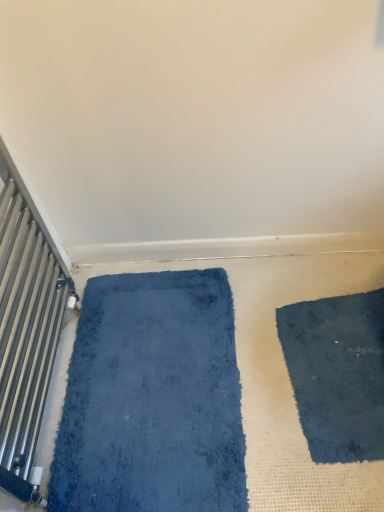
Question: From a real-world perspective, is metallic silver radiator at left positioned over blue plush bath mat at left based on gravity?

Choices:
 (A) no
 (B) yes

Answer: (B)

Question: From the image's perspective, is metallic silver radiator at left below blue plush bath mat at left?

Choices:
 (A) yes
 (B) no

Answer: (B)

Question: Does metallic silver radiator at left have a lesser height compared to blue plush bath mat at left?

Choices:
 (A) no
 (B) yes

Answer: (A)

Question: Is metallic silver radiator at left not near blue plush bath mat at left?

Choices:
 (A) no
 (B) yes

Answer: (A)

Question: Is metallic silver radiator at left oriented towards blue plush bath mat at left?

Choices:
 (A) no
 (B) yes

Answer: (B)

Question: From a real-world perspective, is metallic silver radiator at left physically below blue plush bath mat at left?

Choices:
 (A) no
 (B) yes

Answer: (A)

Question: Is dark blue shaggy mat at lower right oriented towards blue plush bath mat at left?

Choices:
 (A) no
 (B) yes

Answer: (B)

Question: Is dark blue shaggy mat at lower right beside blue plush bath mat at left?

Choices:
 (A) no
 (B) yes

Answer: (A)

Question: Does dark blue shaggy mat at lower right have a greater width compared to blue plush bath mat at left?

Choices:
 (A) no
 (B) yes

Answer: (A)

Question: Considering the relative sizes of dark blue shaggy mat at lower right and blue plush bath mat at left in the image provided, is dark blue shaggy mat at lower right thinner than blue plush bath mat at left?

Choices:
 (A) yes
 (B) no

Answer: (A)

Question: Is dark blue shaggy mat at lower right not inside blue plush bath mat at left?

Choices:
 (A) yes
 (B) no

Answer: (A)

Question: From a real-world perspective, is dark blue shaggy mat at lower right located beneath blue plush bath mat at left?

Choices:
 (A) no
 (B) yes

Answer: (B)

Question: Is the depth of dark blue shaggy mat at lower right less than that of metallic silver radiator at left?

Choices:
 (A) no
 (B) yes

Answer: (A)